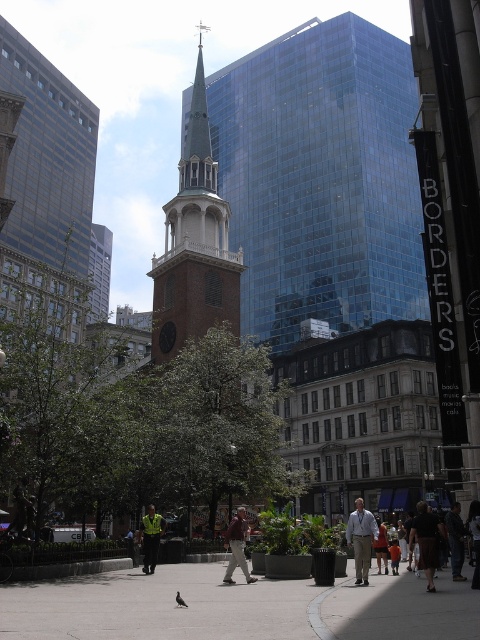
Question: Which object is the closest to the orange cotton shirt at center?

Choices:
 (A) green leafy tree at center
 (B) reflective yellow vest at center

Answer: (B)

Question: Can you confirm if brown leather jacket at center is wider than black feathered pigeon at center?

Choices:
 (A) no
 (B) yes

Answer: (B)

Question: Which object is positioned farthest from the smooth concrete sidewalk at center?

Choices:
 (A) dark gray pants at lower right
 (B) reflective yellow vest at center
 (C) green leafy tree at center
 (D) black feathered pigeon at center

Answer: (C)

Question: Which object is closer to the camera taking this photo?

Choices:
 (A) brown brick steeple at center
 (B) reflective yellow vest at center

Answer: (B)

Question: Can you confirm if khaki pants at center is thinner than brown leather jacket at center?

Choices:
 (A) no
 (B) yes

Answer: (A)

Question: Is reflective yellow vest at center positioned before black feathered pigeon at center?

Choices:
 (A) no
 (B) yes

Answer: (A)